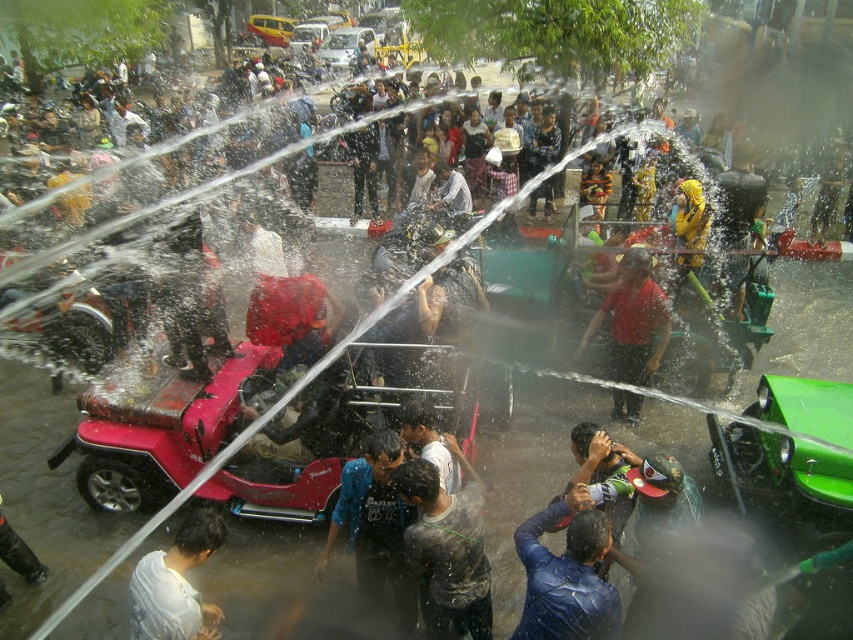
You are a photographer standing at the edge of the water festival crowd. You want to capture a photo of the blue fabric shirt at center. Where should you aim your camera to ensure the shirt is in the frame?

You should aim your camera at the point with coordinates (375, 528) to capture the blue fabric shirt at center in the frame.

You are a photographer trying to capture a closeup shot of the dark blue leather jacket at lower center and the dark gray rubber boot at lower left. Which object should you zoom in on to avoid having to move your camera position?

The dark blue leather jacket at lower center is larger in size than the dark gray rubber boot at lower left, so you should zoom in on the dark blue leather jacket at lower center to avoid moving the camera position since it is bigger and easier to capture without adjusting your position.

You are a photographer standing in the crowd at the water festival. You want to take a photo that includes both the blue fabric shirt at center and the dark gray rubber boot at lower left. Which object should you focus on first to ensure both are in clear view?

You should focus on the blue fabric shirt at center first because it is closer to the viewer than the dark gray rubber boot at lower left, ensuring both will be in focus when focusing on the closer object.